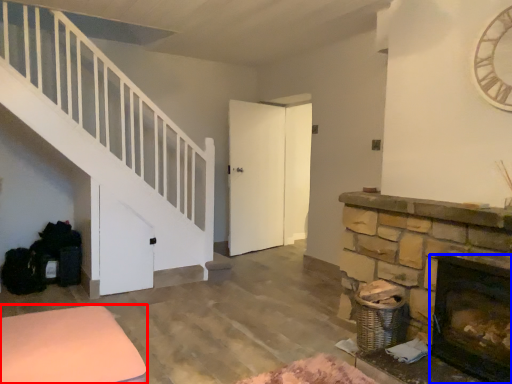
Question: Which of the following is the farthest to the observer, furniture (highlighted by a red box) or fireplace (highlighted by a blue box)?

Choices:
 (A) furniture
 (B) fireplace

Answer: (B)